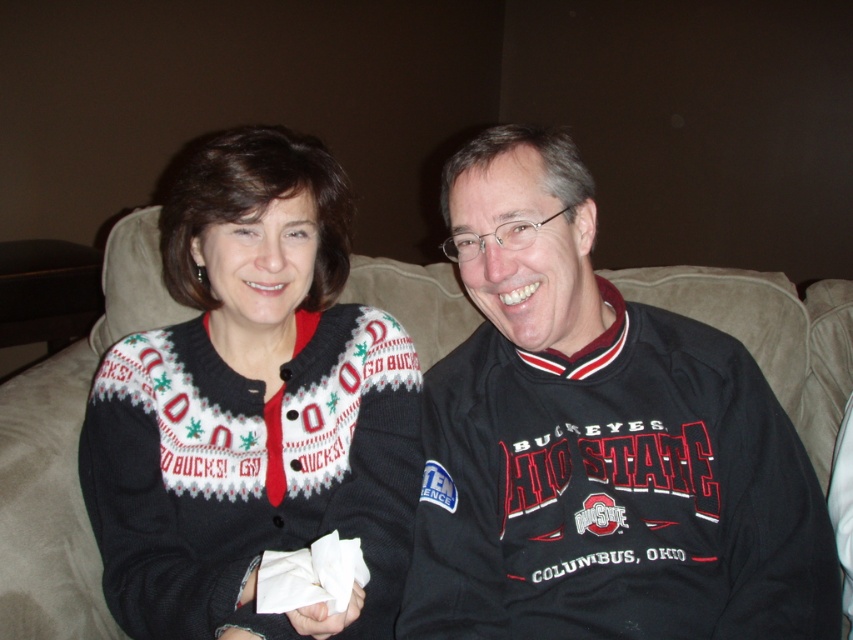
Question: Among these points, which one is nearest to the camera?

Choices:
 (A) (672, 435)
 (B) (27, 618)

Answer: (B)

Question: Can you confirm if knit sweater at center is positioned to the right of suede couch at center?

Choices:
 (A) no
 (B) yes

Answer: (B)

Question: Is knit sweater at center further to camera compared to suede couch at center?

Choices:
 (A) no
 (B) yes

Answer: (A)

Question: Which point is farther to the camera?

Choices:
 (A) (573, 384)
 (B) (41, 540)
 (C) (204, 460)

Answer: (C)

Question: Observing the image, what is the correct spatial positioning of knit sweater at center in reference to suede couch at center?

Choices:
 (A) above
 (B) below

Answer: (A)

Question: Which object is positioned closest to the black jersey at center?

Choices:
 (A) suede couch at center
 (B) knit sweater at center

Answer: (B)